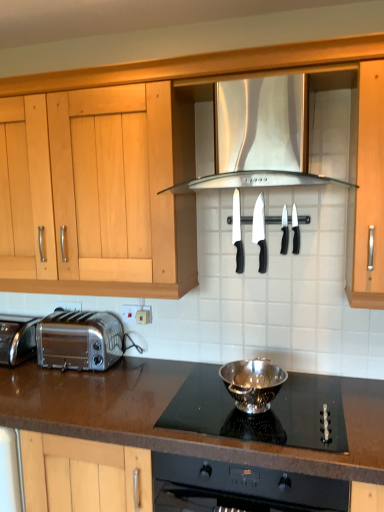
Where is `vacant space situated above brown granite countertop at lower center (from a real-world perspective)`? The height and width of the screenshot is (512, 384). vacant space situated above brown granite countertop at lower center (from a real-world perspective) is located at coordinates (133, 384).